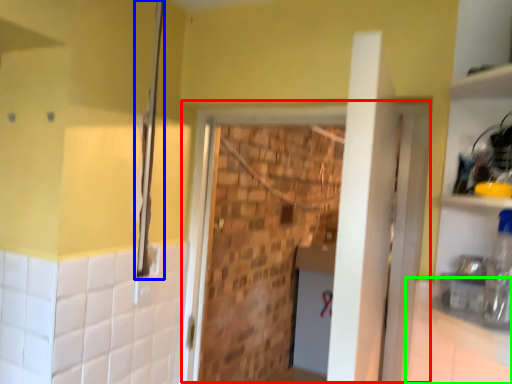
Question: Which is nearer to the screen door (highlighted by a red box)? shower (highlighted by a blue box) or counter top (highlighted by a green box).

Choices:
 (A) shower
 (B) counter top

Answer: (B)